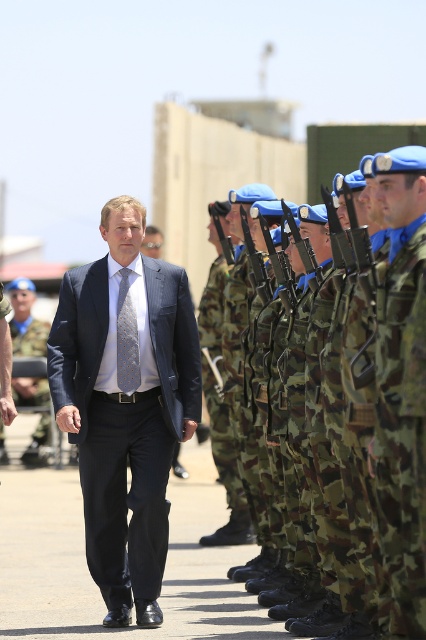
Question: Which of the following is the farthest from the observer?

Choices:
 (A) camo fabric uniform at center
 (B) navy blue suit at center
 (C) matte black suit at center
 (D) silver textured tie at center

Answer: (C)

Question: Considering the real-world distances, which object is farthest from the navy blue suit at center?

Choices:
 (A) silver textured tie at center
 (B) matte black suit at center

Answer: (B)

Question: Can you confirm if camo fabric uniform at center is positioned to the left of silver textured tie at center?

Choices:
 (A) yes
 (B) no

Answer: (B)

Question: Does camo fabric uniform at center appear on the left side of matte black suit at center?

Choices:
 (A) yes
 (B) no

Answer: (B)

Question: Based on their relative distances, which object is farther from the navy blue suit at center?

Choices:
 (A) matte black suit at center
 (B) camo fabric uniform at center

Answer: (A)

Question: Considering the relative positions of navy blue suit at center and matte black suit at center in the image provided, where is navy blue suit at center located with respect to matte black suit at center?

Choices:
 (A) left
 (B) right

Answer: (B)